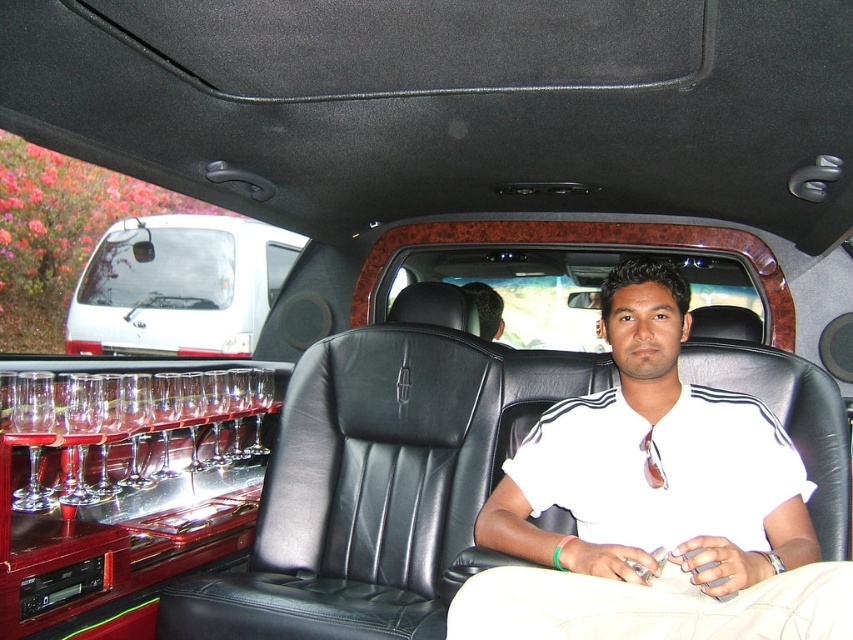
Can you confirm if white matte shirt at center is wider than white glossy minivan at upper left?

No.

Between point (805, 576) and point (91, 253), which one is positioned in front?

Point (805, 576) is in front.

This screenshot has height=640, width=853. In order to click on white matte shirt at center in this screenshot , I will do `click(654, 504)`.

Can you confirm if clear glass wine glass at left is bigger than white glossy minivan at upper left?

No.

Find the location of `clear glass wine glass at left`. clear glass wine glass at left is located at coordinates (131, 428).

Is point (53, 444) positioned behind point (134, 289)?

No.

Identify the location of clear glass wine glass at left. (131, 428).

The image size is (853, 640). What do you see at coordinates (654, 504) in the screenshot? I see `white matte shirt at center` at bounding box center [654, 504].

Does white matte shirt at center appear over clear glass wine glass at left?

Yes.

What do you see at coordinates (654, 504) in the screenshot? I see `white matte shirt at center` at bounding box center [654, 504].

Where is `white matte shirt at center`? white matte shirt at center is located at coordinates (654, 504).